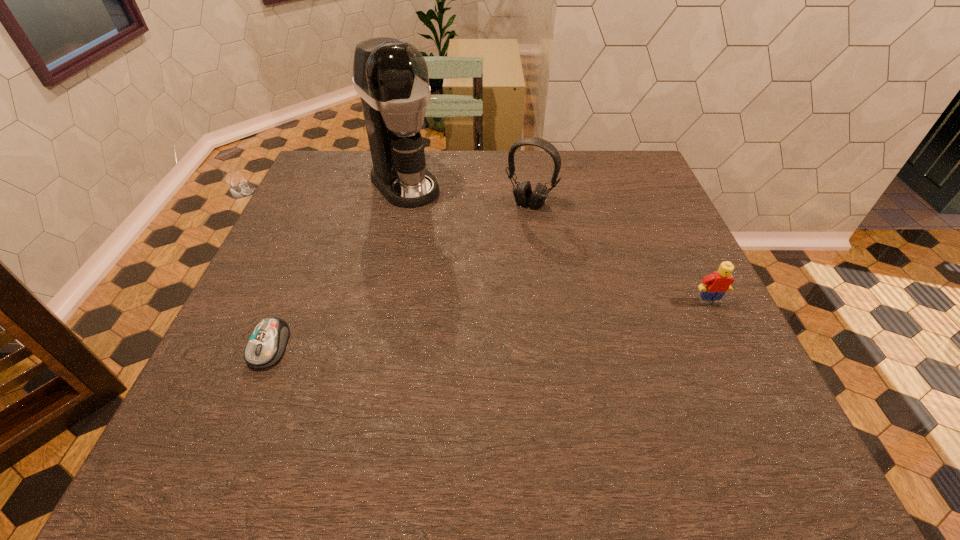
The width and height of the screenshot is (960, 540). I want to click on object located at the near left corner, so click(266, 345).

The width and height of the screenshot is (960, 540). In order to click on free location at the far edge in this screenshot , I will do `click(560, 194)`.

This screenshot has width=960, height=540. Find the location of `vacant space at the left edge`. vacant space at the left edge is located at coordinates (337, 244).

You are a GUI agent. You are given a task and a screenshot of the screen. Output one action in this format:
    pyautogui.click(x=<x>, y=<y>)
    Task: Click on the blank space at the right edge
    The image size is (960, 540).
    Given the screenshot: What is the action you would take?
    pyautogui.click(x=653, y=198)

Identify the location of vacant area at the far left corner of the desktop. (324, 155).

Find the location of a particular element. free region at the far right corner of the desktop is located at coordinates (620, 171).

Locate an element on the screen. The width and height of the screenshot is (960, 540). vacant space at the near right corner of the desktop is located at coordinates (744, 407).

Identify the location of free space that is in between the second object from left to right and the headset. (468, 194).

Where is `vacant region between the third object from right to left and the second tallest object`? vacant region between the third object from right to left and the second tallest object is located at coordinates (468, 194).

At what (x,y) coordinates should I click in order to perform the action: click on vacant space that's between the rightmost object and the tallest object. Please return your answer as a coordinate pair (x, y). Looking at the image, I should click on (557, 242).